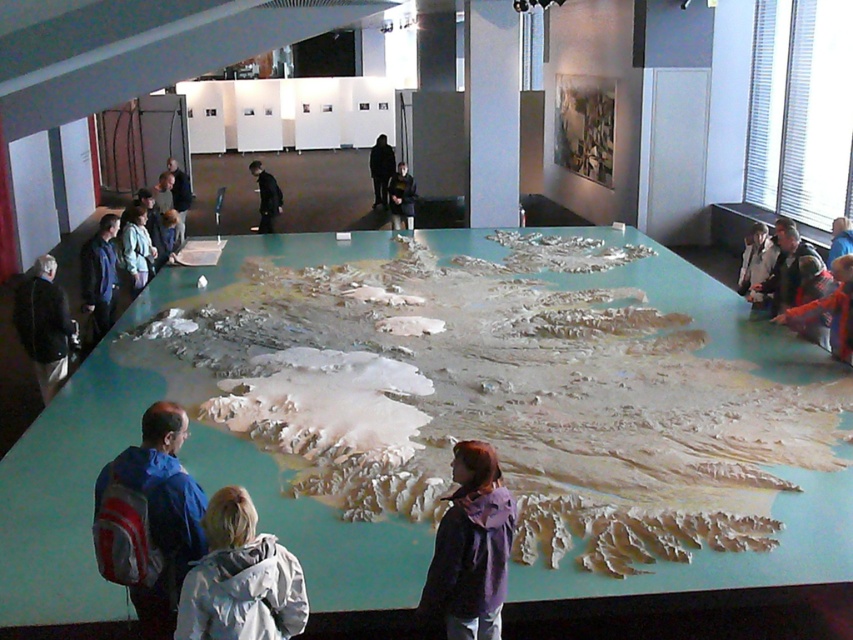
Question: In this image, where is dark blue jacket at left located relative to blue fabric jacket at upper right?

Choices:
 (A) below
 (B) above

Answer: (A)

Question: Is dark gray sweater at center thinner than black matte jacket at center?

Choices:
 (A) no
 (B) yes

Answer: (A)

Question: Which object is farther from the camera taking this photo?

Choices:
 (A) light blue fabric jacket at left
 (B) red plaid shirt at right
 (C) dark blue jacket at center
 (D) blue fabric jacket at upper right

Answer: (C)

Question: Considering the real-world distances, which object is farthest from the blue fabric backpack at lower left?

Choices:
 (A) black matte jacket at center
 (B) light blue fabric jacket at left
 (C) dark blue jacket at left
 (D) light blue fabric jacket at center

Answer: (D)

Question: Which object is the farthest from the dark blue jacket at center?

Choices:
 (A) white matte jacket at lower center
 (B) blue fabric backpack at lower left
 (C) dark gray sweater at center
 (D) light blue fabric jacket at left

Answer: (A)

Question: Is dark blue jacket at left smaller than blue fabric jacket at left?

Choices:
 (A) no
 (B) yes

Answer: (A)